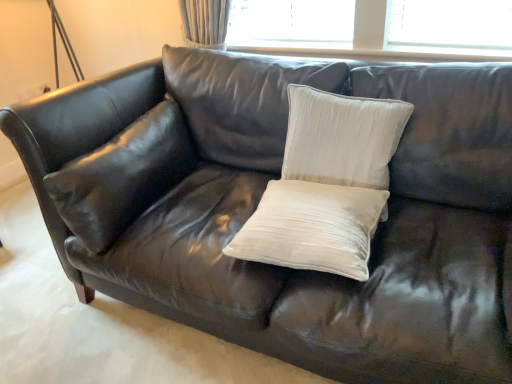
Question: Is white velvet pillow at center, which is counted as the third pillow, starting from the left, at the left side of satin white pillow at center, which is counted as the third pillow, starting from the right?

Choices:
 (A) yes
 (B) no

Answer: (B)

Question: Are white velvet pillow at center, which is counted as the third pillow, starting from the left, and satin white pillow at center, which is the 1th pillow from left to right, making contact?

Choices:
 (A) yes
 (B) no

Answer: (B)

Question: Is white velvet pillow at center, which is counted as the third pillow, starting from the left, positioned with its back to satin white pillow at center, which is the 1th pillow from left to right?

Choices:
 (A) yes
 (B) no

Answer: (B)

Question: Considering the relative sizes of white velvet pillow at center, arranged as the 1th pillow when viewed from the right, and satin white pillow at center, which is the 1th pillow from left to right, in the image provided, is white velvet pillow at center, arranged as the 1th pillow when viewed from the right, shorter than satin white pillow at center, which is the 1th pillow from left to right,?

Choices:
 (A) yes
 (B) no

Answer: (B)

Question: Are white velvet pillow at center, arranged as the 1th pillow when viewed from the right, and satin white pillow at center, which is the 1th pillow from left to right, located far from each other?

Choices:
 (A) no
 (B) yes

Answer: (A)

Question: From the image's perspective, is satin white pillow at center, which is the 1th pillow from left to right, positioned above or below white velvet pillow at center, arranged as the 1th pillow when viewed from the right?

Choices:
 (A) below
 (B) above

Answer: (A)

Question: Is satin white pillow at center, which is the 1th pillow from left to right, taller or shorter than white velvet pillow at center, which is counted as the third pillow, starting from the left?

Choices:
 (A) short
 (B) tall

Answer: (A)

Question: Based on their positions, is satin white pillow at center, which is counted as the third pillow, starting from the right, located to the left or right of white velvet pillow at center, arranged as the 1th pillow when viewed from the right?

Choices:
 (A) right
 (B) left

Answer: (B)

Question: Does point (99, 147) appear closer or farther from the camera than point (381, 140)?

Choices:
 (A) closer
 (B) farther

Answer: (B)

Question: Is point (385, 109) closer or farther from the camera than point (72, 195)?

Choices:
 (A) closer
 (B) farther

Answer: (B)

Question: Looking at their shapes, would you say white velvet pillow at center, which is counted as the third pillow, starting from the left, is wider or thinner than satin white pillow at center, which is the 1th pillow from left to right?

Choices:
 (A) thin
 (B) wide

Answer: (A)

Question: Is white velvet pillow at center, which is counted as the third pillow, starting from the left, to the left or to the right of satin white pillow at center, which is counted as the third pillow, starting from the right, in the image?

Choices:
 (A) left
 (B) right

Answer: (B)

Question: From the image's perspective, is white velvet pillow at center, which is counted as the third pillow, starting from the left, located above or below satin white pillow at center, which is the 1th pillow from left to right?

Choices:
 (A) below
 (B) above

Answer: (B)

Question: In terms of size, does satin white pillow at center, which is counted as the third pillow, starting from the right, appear bigger or smaller than satin white pillow at center, acting as the 2th pillow starting from the left?

Choices:
 (A) big
 (B) small

Answer: (A)

Question: Relative to satin white pillow at center, which ranks as the second pillow in right-to-left order, is satin white pillow at center, which is counted as the third pillow, starting from the right, in front or behind?

Choices:
 (A) behind
 (B) front

Answer: (A)